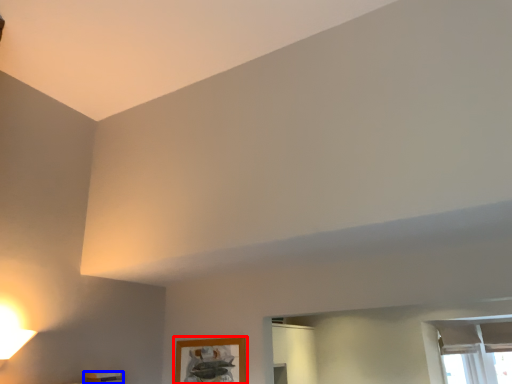
Question: Which point is closer to the camera, picture frame (highlighted by a red box) or furniture (highlighted by a blue box)?

Choices:
 (A) picture frame
 (B) furniture

Answer: (B)